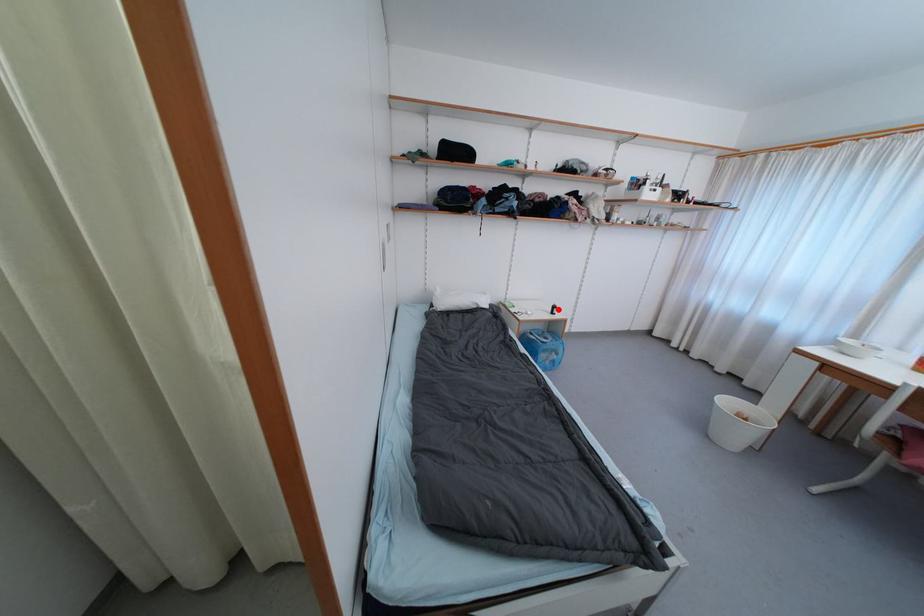
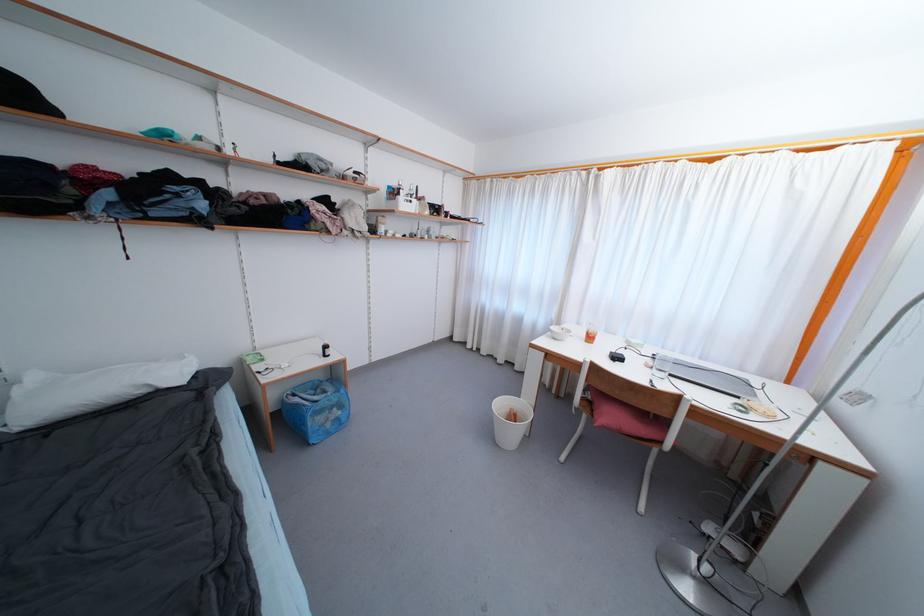
Find the pixel in the second image that matches the highlighted location in the first image.

(330, 350)